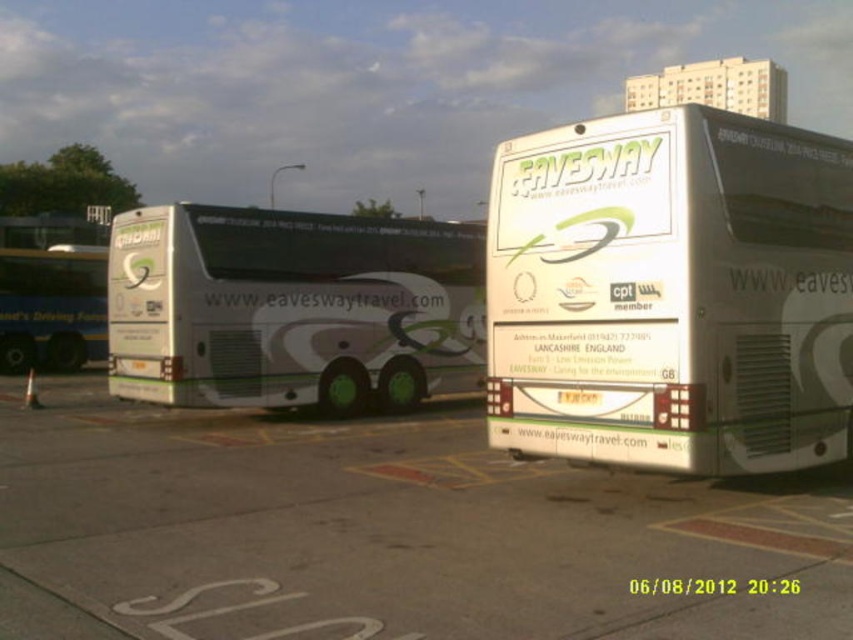
Looking at this image, you are standing at the entrance of the bus station and want to walk to the concrete pavement at center. Which direction should you head?

The concrete pavement at center is located at point coordinates, so you should head towards the center of the image to reach it.

You are a delivery person trying to unload a package from your truck. You need to place it on the ground near the green matte bus at left. Where should you put the package so it stays on the concrete pavement at center?

You should place the package on the concrete pavement at center because it is positioned under the green matte bus at left, ensuring the package stays near the bus while remaining on the pavement.